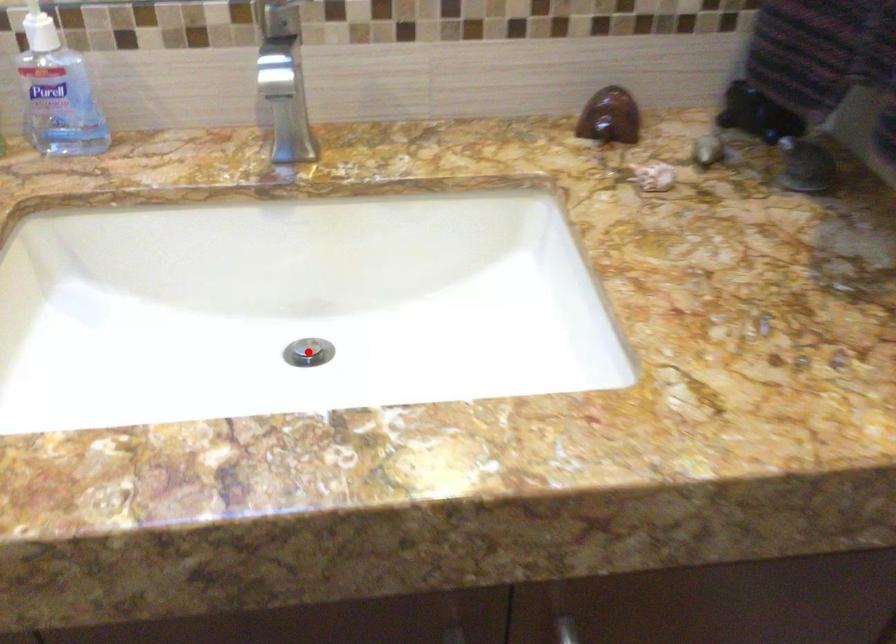
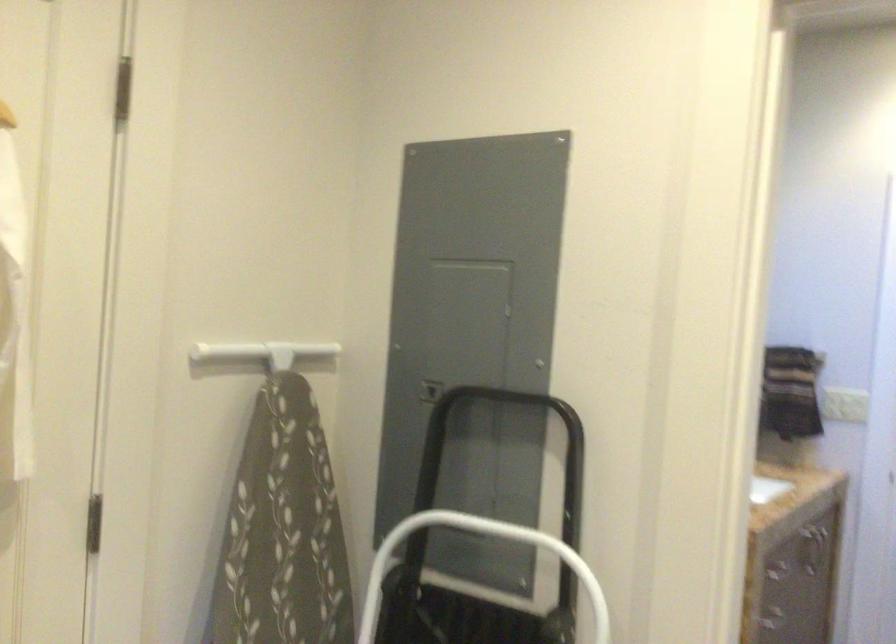
Question: I am providing you with two images of the same scene from different viewpoints. A red point is marked on the first image. Is the red point's position out of view in image 2?

Choices:
 (A) Yes
 (B) No

Answer: (A)